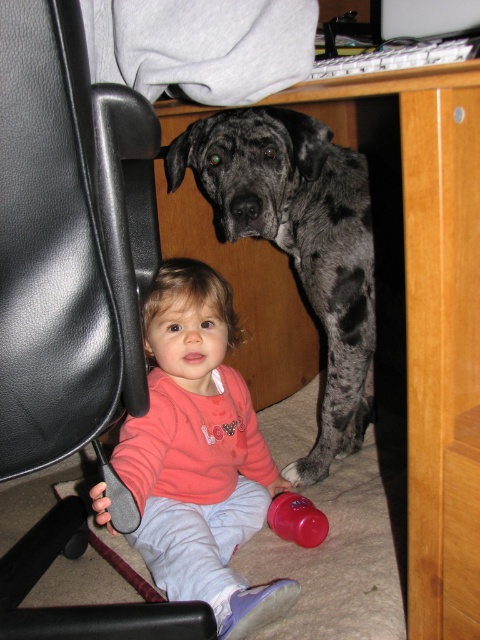
You are a parent trying to ensure your child stays safe while playing. The wooden at center and the black leather swivel chair at left are in the scene. Which object is positioned higher than the other?

The wooden at center is located above the black leather swivel chair at left, so the wooden at center is higher than the black leather swivel chair at left.

You are a parent trying to decide whether to let your child wear the pink fleece sweater at lower left while sitting on the wooden at center. Considering the size of the sweater and the wooden, will the sweater be big enough to keep the child warm?

The wooden at center is larger in size than the pink fleece sweater at lower left. However, the size of the wooden does not affect the sweater size. The pink fleece sweater at lower left may or may not be appropriate for the child, but its size relative to the wooden cannot determine its warmth capacity.

You are a parent trying to place a small potted plant on a surface in the room. You have two options available in the image, the wooden at center and the black leather swivel chair at left. Which surface would you choose if you want the plant to be taller than the chair?

→ The wooden at center has a greater height compared to the black leather swivel chair at left, so placing the plant on the wooden at center would make it taller than the chair.